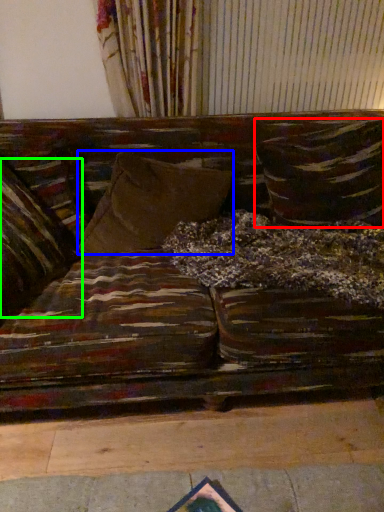
Question: Which object is the closest to the pillow (highlighted by a red box)? Choose among these: pillow (highlighted by a blue box) or pillow (highlighted by a green box).

Choices:
 (A) pillow
 (B) pillow

Answer: (A)